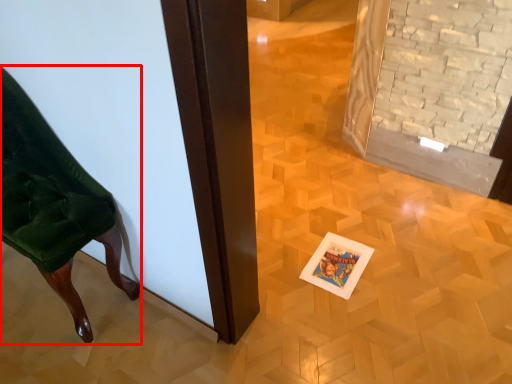
Question: From the image's perspective, considering the relative positions of furniture (annotated by the red box) and postcard in the image provided, where is furniture (annotated by the red box) located with respect to the staircase?

Choices:
 (A) below
 (B) above

Answer: (B)